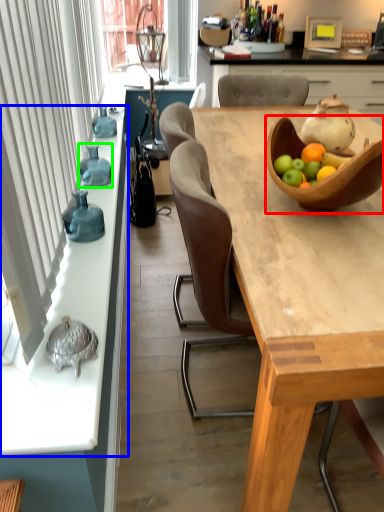
Question: Which object is the farthest from tableware (highlighted by a red box)? Choose among these: countertop (highlighted by a blue box) or vase (highlighted by a green box).

Choices:
 (A) countertop
 (B) vase

Answer: (B)